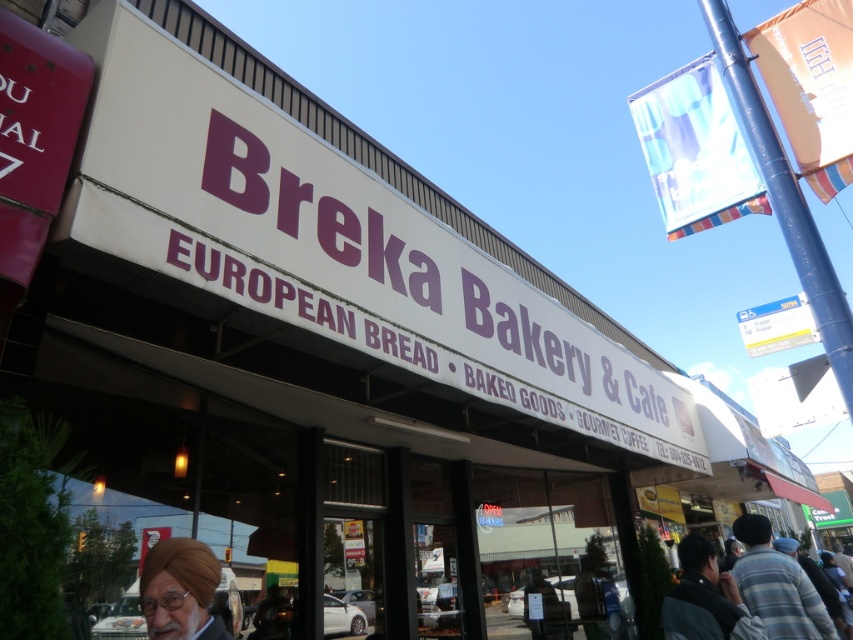
Can you confirm if striped cotton shirt at lower right is wider than matte brown turban at lower left?

Correct, the width of striped cotton shirt at lower right exceeds that of matte brown turban at lower left.

Which of these two, striped cotton shirt at lower right or matte brown turban at lower left, stands taller?

striped cotton shirt at lower right is taller.

Identify the location of striped cotton shirt at lower right. The width and height of the screenshot is (853, 640). (776, 586).

Identify the location of striped cotton shirt at lower right. (776, 586).

Can you confirm if white matte sign at center is thinner than striped cotton shirt at lower right?

Incorrect, white matte sign at center's width is not less than striped cotton shirt at lower right's.

Does point (646, 412) come closer to viewer compared to point (746, 515)?

Yes, point (646, 412) is closer to viewer.

Looking at this image, who is more forward, (115, 68) or (776, 620)?

Point (115, 68) is in front.

Locate an element on the screen. The width and height of the screenshot is (853, 640). white matte sign at center is located at coordinates [x=335, y=244].

Is matte brown turban at lower left taller than dark gray jacket at lower right?

Incorrect, matte brown turban at lower left's height is not larger of dark gray jacket at lower right's.

Between matte brown turban at lower left and dark gray jacket at lower right, which one is positioned higher?

matte brown turban at lower left is above.

Between point (213, 588) and point (717, 596), which one is positioned behind?

The point (717, 596) is more distant.

Locate an element on the screen. This screenshot has height=640, width=853. matte brown turban at lower left is located at coordinates (180, 589).